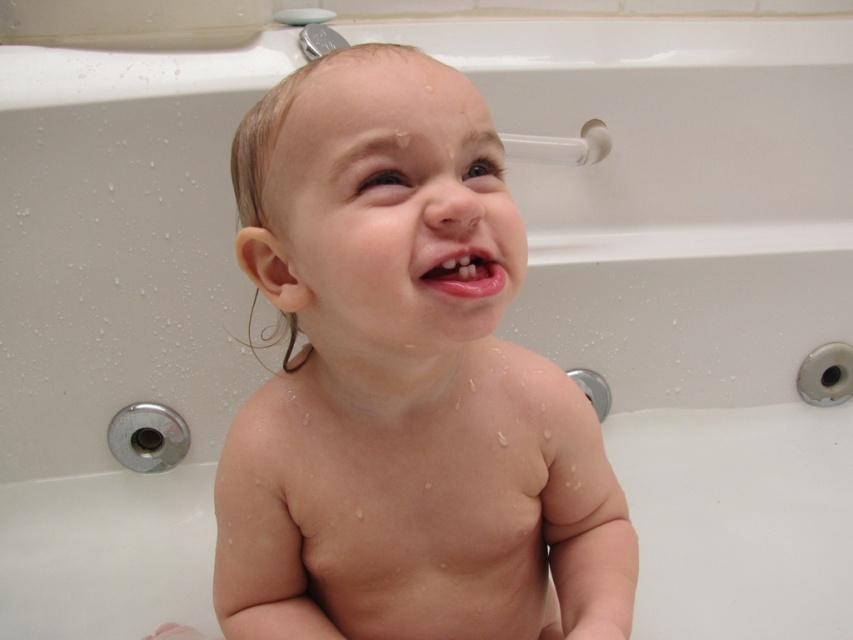
You are a pediatrician examining a child in a bathtub. You notice the smooth skin baby at center and the pink glossy lips at center. Which of these two features is bigger in size?

The smooth skin baby at center is larger in size compared to the pink glossy lips at center.

In the scene shown: In the scene of a child in a white bathtub, where the child has wet skin and a displeased expression, you notice the smooth skin baby at center and the pink glossy lips at center. Which object is located to the left of the other?

The smooth skin baby at center is positioned on the left side of pink glossy lips at center.

You are a pediatrician examining a baby in the bathtub. You need to determine if the baby can fit a pacifier in their mouth. The pacifier is 3 cm wide. Can the baby fit the pacifier in their mouth based on the size comparison between the smooth skin baby at center and pink glossy lips at center?

The smooth skin baby at center is wider than the pink glossy lips at center. Since the pacifier is 3 cm wide, and the baby has wider cheeks, it should fit comfortably in their mouth.